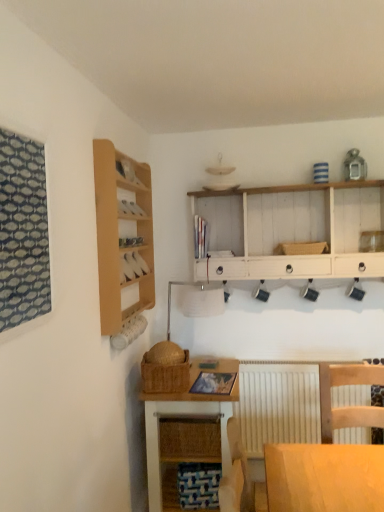
The width and height of the screenshot is (384, 512). Identify the location of vacant area on top of white matte radiator at lower center (from a real-world perspective). [x=295, y=361].